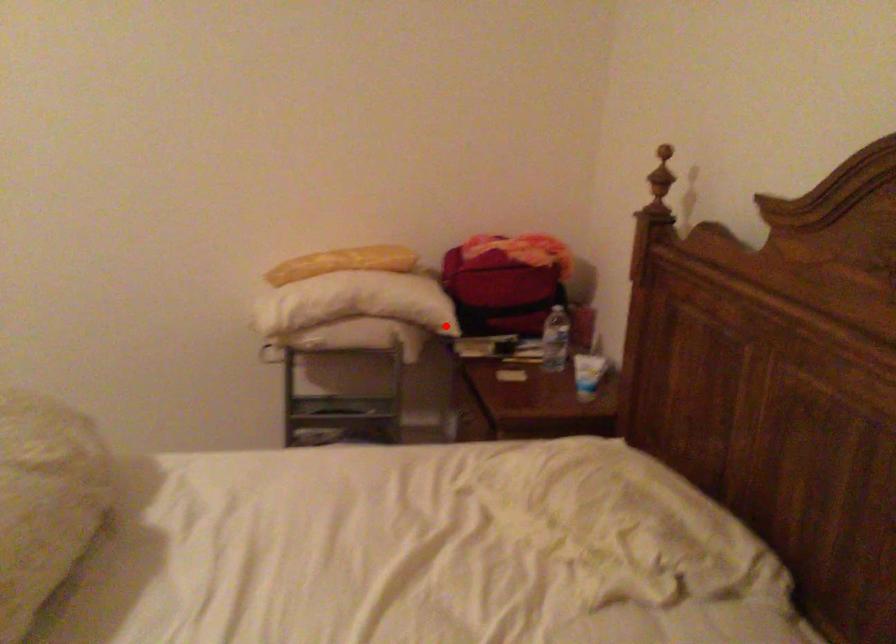
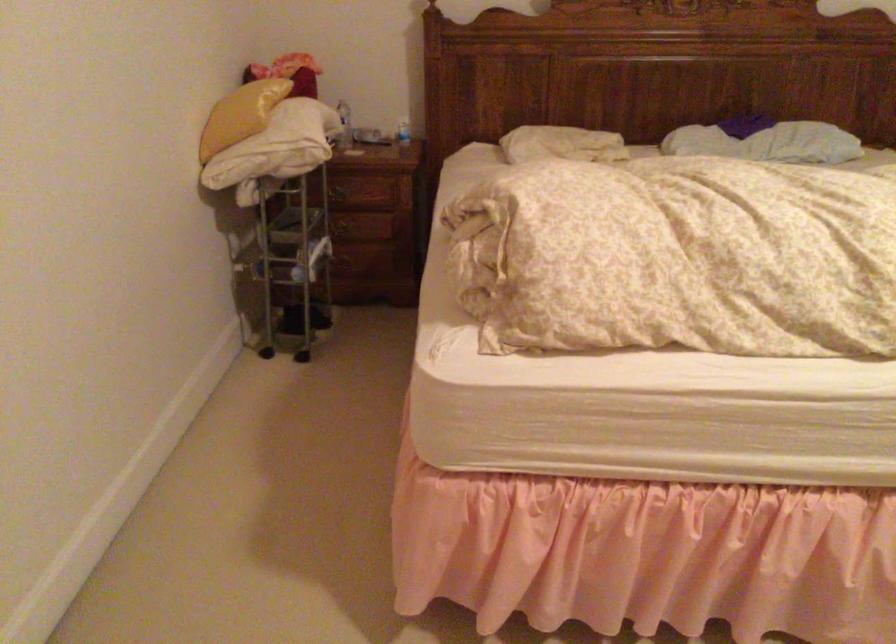
Where in the second image is the point corresponding to the highlighted location from the first image?

(343, 125)